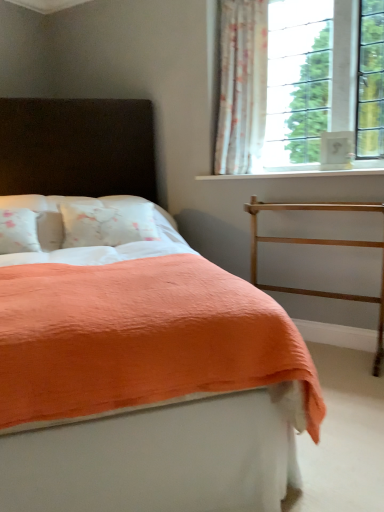
Question: Is gold metallic balustrade at right thinner than coral fabric bed at center?

Choices:
 (A) no
 (B) yes

Answer: (B)

Question: Is gold metallic balustrade at right closer to camera compared to coral fabric bed at center?

Choices:
 (A) yes
 (B) no

Answer: (B)

Question: Considering the relative sizes of gold metallic balustrade at right and coral fabric bed at center in the image provided, is gold metallic balustrade at right smaller than coral fabric bed at center?

Choices:
 (A) no
 (B) yes

Answer: (B)

Question: Is gold metallic balustrade at right shorter than coral fabric bed at center?

Choices:
 (A) no
 (B) yes

Answer: (B)

Question: Is gold metallic balustrade at right turned away from coral fabric bed at center?

Choices:
 (A) yes
 (B) no

Answer: (B)

Question: Relative to coral fabric bed at center, is white smooth window sill at upper right in front or behind?

Choices:
 (A) behind
 (B) front

Answer: (A)

Question: Is white smooth window sill at upper right spatially inside coral fabric bed at center, or outside of it?

Choices:
 (A) outside
 (B) inside

Answer: (A)

Question: In terms of width, does white smooth window sill at upper right look wider or thinner when compared to coral fabric bed at center?

Choices:
 (A) thin
 (B) wide

Answer: (A)

Question: From the image's perspective, relative to coral fabric bed at center, is white smooth window sill at upper right above or below?

Choices:
 (A) above
 (B) below

Answer: (A)

Question: Considering the relative positions of white floral fabric curtain at upper right and white smooth window sill at upper right in the image provided, is white floral fabric curtain at upper right to the left or to the right of white smooth window sill at upper right?

Choices:
 (A) left
 (B) right

Answer: (A)

Question: Is point (249, 52) positioned closer to the camera than point (286, 173)?

Choices:
 (A) closer
 (B) farther

Answer: (B)

Question: Considering their positions, is white floral fabric curtain at upper right located in front of or behind white smooth window sill at upper right?

Choices:
 (A) behind
 (B) front

Answer: (A)

Question: From a real-world perspective, is white floral fabric curtain at upper right physically located above or below white smooth window sill at upper right?

Choices:
 (A) above
 (B) below

Answer: (A)

Question: Is white smooth window sill at upper right to the left or to the right of gold metallic balustrade at right in the image?

Choices:
 (A) left
 (B) right

Answer: (A)

Question: From a real-world perspective, is white smooth window sill at upper right above or below gold metallic balustrade at right?

Choices:
 (A) above
 (B) below

Answer: (A)